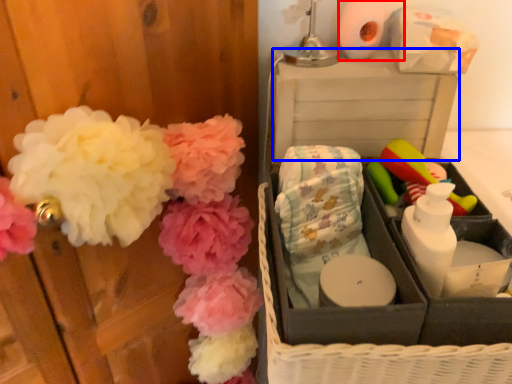
Question: Which point is closer to the camera, toilet paper (highlighted by a red box) or storage box (highlighted by a blue box)?

Choices:
 (A) toilet paper
 (B) storage box

Answer: (B)